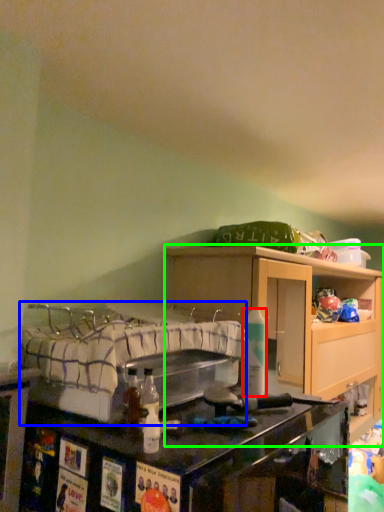
Question: Which is nearer to the bottle (highlighted by a red box)? bed (highlighted by a blue box) or cabinetry (highlighted by a green box).

Choices:
 (A) bed
 (B) cabinetry

Answer: (A)